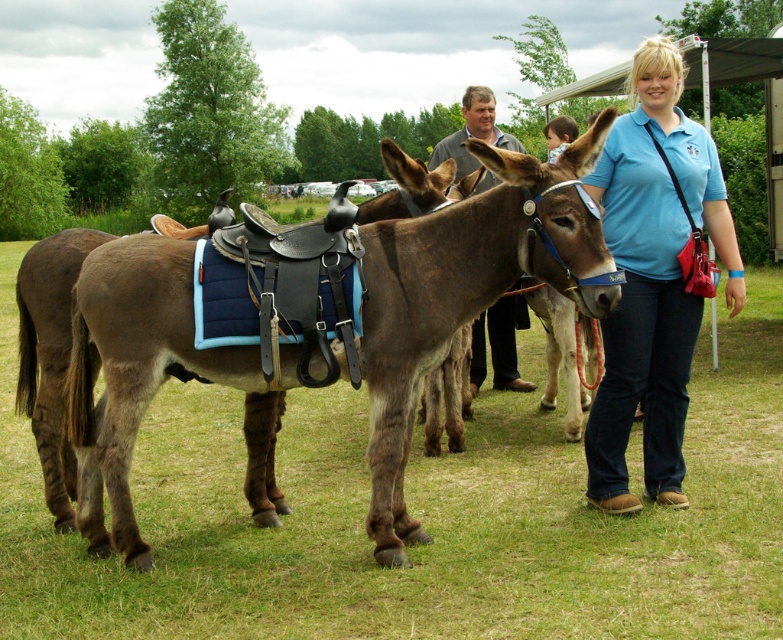
Question: Where is blue cotton shirt at center located in relation to gray woolen sweater at center in the image?

Choices:
 (A) below
 (B) above

Answer: (A)

Question: Which point is closer to the camera?

Choices:
 (A) (473, 388)
 (B) (705, 220)

Answer: (B)

Question: Among these objects, which one is nearest to the camera?

Choices:
 (A) brown leather saddle at center
 (B) blue cotton shirt at center
 (C) green grass at lower center

Answer: (C)

Question: Is blue cotton shirt at center bigger than blonde hair at upper right?

Choices:
 (A) yes
 (B) no

Answer: (B)

Question: Is green grass at lower center bigger than brown leather saddle at center?

Choices:
 (A) yes
 (B) no

Answer: (A)

Question: Which object appears closest to the camera in this image?

Choices:
 (A) blonde hair at upper right
 (B) gray woolen sweater at center

Answer: (A)